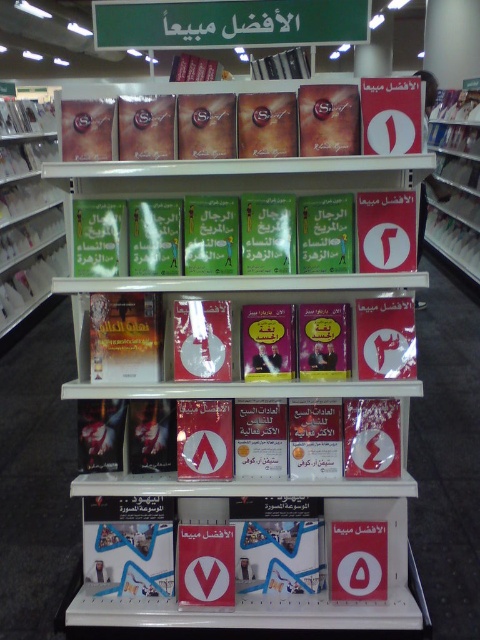
Between matte plastic book at left and red matte book at center, which one has more height?

With more height is matte plastic book at left.

Does matte plastic book at left lie behind red matte book at center?

No, it is not.

Does point (21, 188) lie in front of point (454, 208)?

Yes, point (21, 188) is in front of point (454, 208).

Locate an element on the screen. matte plastic book at left is located at coordinates (27, 212).

Who is higher up, greenmaterial/texturesign at upper center or matte plastic book at left?

matte plastic book at left is higher up.

Who is shorter, greenmaterial/texturesign at upper center or matte plastic book at left?

With less height is greenmaterial/texturesign at upper center.

Describe the element at coordinates (228, 22) in the screenshot. I see `greenmaterial/texturesign at upper center` at that location.

What are the coordinates of `greenmaterial/texturesign at upper center` in the screenshot? It's located at (228, 22).

Is greenmaterial/texturesign at upper center thinner than red matte book at center?

No, greenmaterial/texturesign at upper center is not thinner than red matte book at center.

Does greenmaterial/texturesign at upper center have a greater height compared to red matte book at center?

In fact, greenmaterial/texturesign at upper center may be shorter than red matte book at center.

Which is in front, point (230, 20) or point (460, 164)?

Point (230, 20) is in front.

Find the location of a particular element. This screenshot has width=480, height=640. greenmaterial/texturesign at upper center is located at coordinates (x=228, y=22).